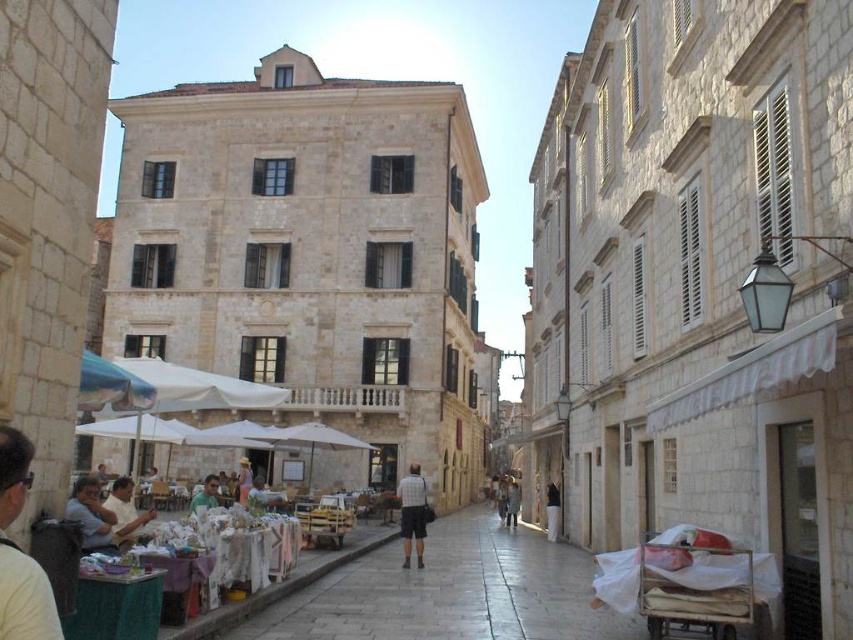
You are standing at the point labeled point (213,493) and want to walk to the point labeled point (108,518). Which direction should you face to walk directly towards your destination?

You should face north because point (108,518) is in front of point (213,493), indicating it is north of your current position.

Looking at this image, you are standing in a historic European town square with a cafe on the left side of the street. There is a point marked at coordinates point (27, 570). If you want to take a photo that includes both the cafe tables and this specific point, would you need to adjust your position to ensure both are in frame?

The point (27, 570) is 28.04 meters away from the viewer. Since the cafe tables are on the left side of the street and the point is quite far, you would need to move closer to the point or use a wide angle lens to include both the cafe tables and the point in the photo.

You are standing at the center of the street in the historic town scene. You see a light brown leather jacket at lower left. Can you estimate its position relative to the center of the street?

The light brown leather jacket at lower left is positioned at coordinates approximately 0.863 on the x and 0.025 on the y axis relative to the center of the street.